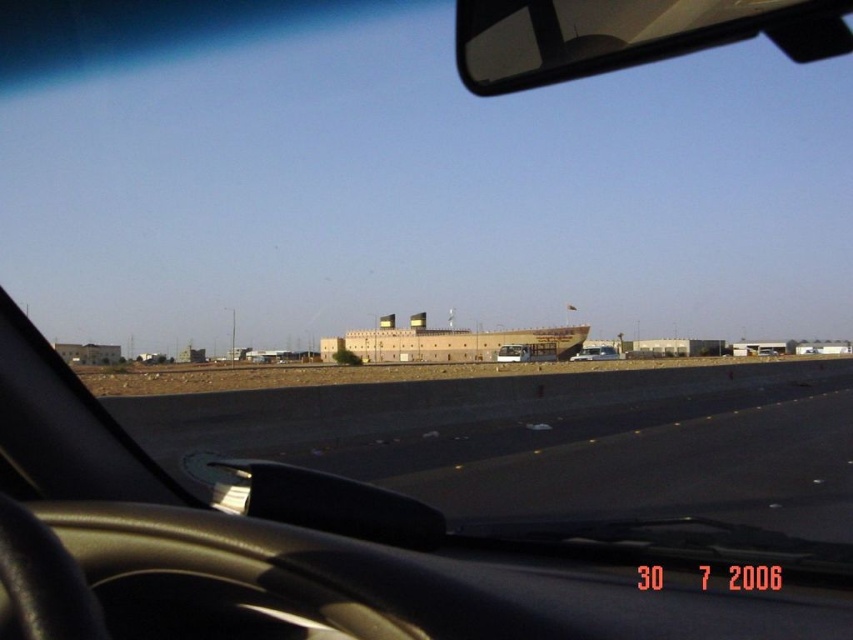
The height and width of the screenshot is (640, 853). What do you see at coordinates (595, 353) in the screenshot? I see `white matte van at center` at bounding box center [595, 353].

Does white matte van at center have a larger size compared to matte black car at center?

Yes, white matte van at center is bigger than matte black car at center.

The height and width of the screenshot is (640, 853). Describe the element at coordinates (595, 353) in the screenshot. I see `white matte van at center` at that location.

The height and width of the screenshot is (640, 853). Identify the location of white matte van at center. (595, 353).

Who is lower down, transparent plastic view mirror at upper center or matte black car at center?

matte black car at center

Where is `transparent plastic view mirror at upper center`? The width and height of the screenshot is (853, 640). transparent plastic view mirror at upper center is located at coordinates (625, 35).

Is transparent plastic view mirror at upper center to the left of white matte van at center from the viewer's perspective?

Correct, you'll find transparent plastic view mirror at upper center to the left of white matte van at center.

This screenshot has height=640, width=853. I want to click on transparent plastic view mirror at upper center, so click(x=625, y=35).

Identify the location of transparent plastic view mirror at upper center. (625, 35).